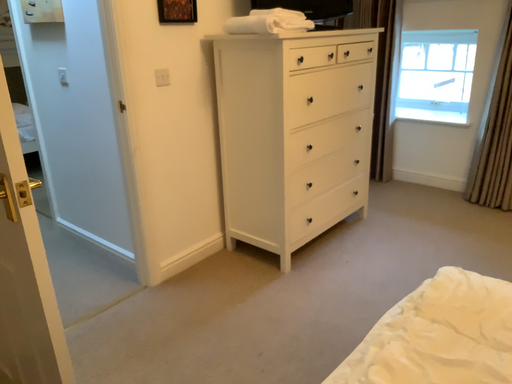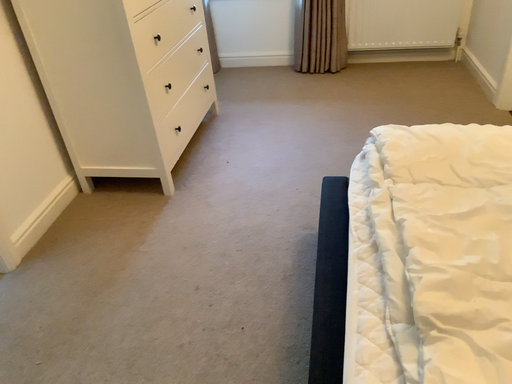
Question: Which way did the camera rotate in the video?

Choices:
 (A) rotated downward
 (B) rotated upward

Answer: (A)